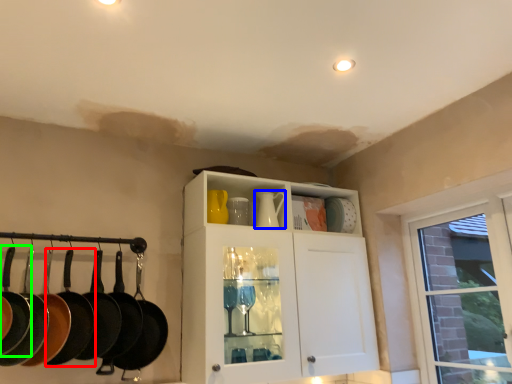
Question: Estimate the real-world distances between objects in this image. Which object is farther from frying pan (highlighted by a red box), tea pot (highlighted by a blue box) or frying pan (highlighted by a green box)?

Choices:
 (A) tea pot
 (B) frying pan

Answer: (A)